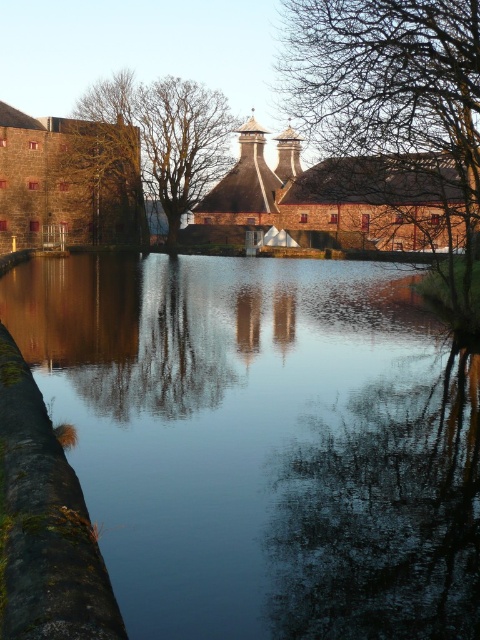
Can you confirm if bare branches at upper center is positioned to the right of brown wood tree at upper left?

Yes, bare branches at upper center is to the right of brown wood tree at upper left.

Who is more forward, (386, 157) or (106, 198)?

Point (386, 157)

What do you see at coordinates (393, 102) in the screenshot?
I see `bare branches at upper center` at bounding box center [393, 102].

This screenshot has height=640, width=480. Identify the location of bare branches at upper center. (393, 102).

Locate an element on the screen. smooth reflective water at center is located at coordinates (263, 442).

Is smooth reflective water at center positioned at the back of brown wood tree at upper left?

No.

From the picture: Who is more forward, (241,317) or (81,198)?

Point (241,317) is more forward.

Identify the location of smooth reflective water at center. (263, 442).

Who is higher up, brown wood tree at upper left or bare wood tree at center?

brown wood tree at upper left is above.

Does brown wood tree at upper left have a lesser width compared to bare wood tree at center?

Yes.

Measure the distance between brown wood tree at upper left and camera.

They are 71.10 meters apart.

The width and height of the screenshot is (480, 640). In order to click on brown wood tree at upper left in this screenshot , I will do `click(106, 163)`.